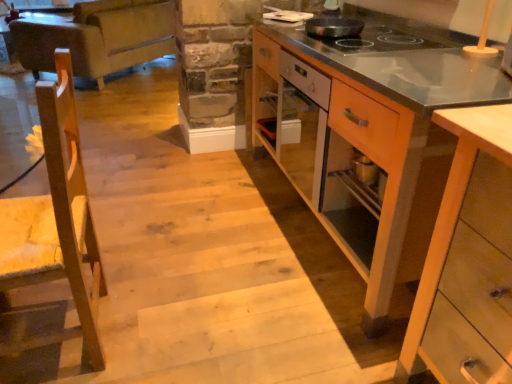
Question: Is wooden cabinet at right, the first cabinetry viewed from the back, aimed at black non-stick pan at upper center?

Choices:
 (A) yes
 (B) no

Answer: (B)

Question: Is wooden cabinet at right, the first cabinetry viewed from the back, closer to camera compared to black non-stick pan at upper center?

Choices:
 (A) no
 (B) yes

Answer: (B)

Question: Is wooden cabinet at right, the first cabinetry viewed from the back, bigger than black non-stick pan at upper center?

Choices:
 (A) yes
 (B) no

Answer: (A)

Question: Does wooden cabinet at right, which is the 2th cabinetry from front to back, have a greater width compared to black non-stick pan at upper center?

Choices:
 (A) yes
 (B) no

Answer: (A)

Question: Can you confirm if wooden cabinet at right, which is the 2th cabinetry from front to back, is thinner than black non-stick pan at upper center?

Choices:
 (A) no
 (B) yes

Answer: (A)

Question: Is wooden chair at left to the left or to the right of light wood cabinet at lower right, the 1th cabinetry in the front-to-back sequence, in the image?

Choices:
 (A) right
 (B) left

Answer: (B)

Question: From the image's perspective, relative to light wood cabinet at lower right, the 1th cabinetry in the front-to-back sequence, is wooden chair at left above or below?

Choices:
 (A) above
 (B) below

Answer: (A)

Question: Considering the positions of wooden chair at left and light wood cabinet at lower right, which ranks as the second cabinetry in back-to-front order, in the image, is wooden chair at left taller or shorter than light wood cabinet at lower right, which ranks as the second cabinetry in back-to-front order,?

Choices:
 (A) short
 (B) tall

Answer: (B)

Question: Choose the correct answer: Is wooden chair at left inside light wood cabinet at lower right, the 1th cabinetry in the front-to-back sequence, or outside it?

Choices:
 (A) outside
 (B) inside

Answer: (A)

Question: In terms of height, does black non-stick pan at upper center look taller or shorter compared to light wood cabinet at lower right, the 1th cabinetry in the front-to-back sequence?

Choices:
 (A) short
 (B) tall

Answer: (A)

Question: From the image's perspective, is black non-stick pan at upper center positioned above or below light wood cabinet at lower right, the 1th cabinetry in the front-to-back sequence?

Choices:
 (A) above
 (B) below

Answer: (A)

Question: In the image, is black non-stick pan at upper center positioned in front of or behind light wood cabinet at lower right, the 1th cabinetry in the front-to-back sequence?

Choices:
 (A) front
 (B) behind

Answer: (B)

Question: Is point (336, 29) positioned closer to the camera than point (497, 279)?

Choices:
 (A) farther
 (B) closer

Answer: (A)

Question: Which is correct: light wood cabinet at lower right, which ranks as the second cabinetry in back-to-front order, is inside black non-stick pan at upper center, or outside of it?

Choices:
 (A) inside
 (B) outside

Answer: (B)

Question: Considering the positions of light wood cabinet at lower right, which ranks as the second cabinetry in back-to-front order, and black non-stick pan at upper center in the image, is light wood cabinet at lower right, which ranks as the second cabinetry in back-to-front order, taller or shorter than black non-stick pan at upper center?

Choices:
 (A) short
 (B) tall

Answer: (B)